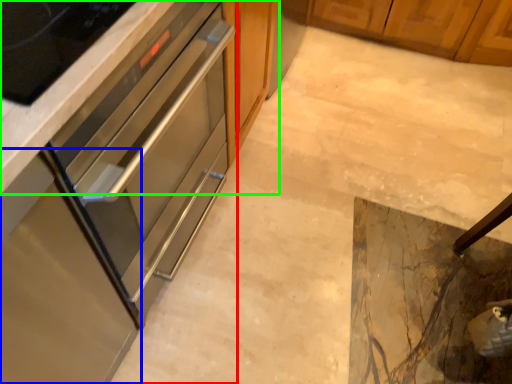
Question: Considering the real-world distances, which object is farthest from cabinetry (highlighted by a red box)? cabinetry (highlighted by a blue box) or cabinetry (highlighted by a green box)?

Choices:
 (A) cabinetry
 (B) cabinetry

Answer: (B)